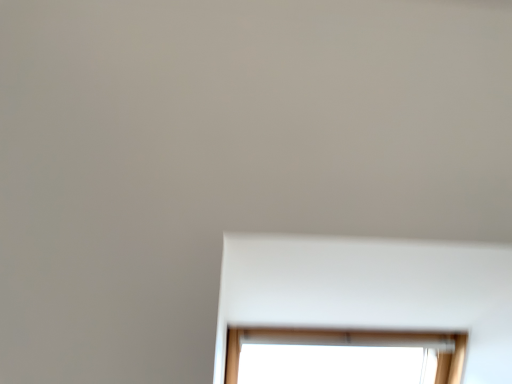
Question: Choose the correct answer: Is white matte bay window at lower center inside transparent glass window at center or outside it?

Choices:
 (A) outside
 (B) inside

Answer: (A)

Question: Considering the positions of white matte bay window at lower center and transparent glass window at center in the image, is white matte bay window at lower center bigger or smaller than transparent glass window at center?

Choices:
 (A) small
 (B) big

Answer: (A)

Question: Considering the positions of white matte bay window at lower center and transparent glass window at center in the image, is white matte bay window at lower center taller or shorter than transparent glass window at center?

Choices:
 (A) tall
 (B) short

Answer: (B)

Question: Considering their positions, is transparent glass window at center located in front of or behind white matte bay window at lower center?

Choices:
 (A) front
 (B) behind

Answer: (B)

Question: In terms of width, does transparent glass window at center look wider or thinner when compared to white matte bay window at lower center?

Choices:
 (A) wide
 (B) thin

Answer: (B)

Question: From their relative heights in the image, would you say transparent glass window at center is taller or shorter than white matte bay window at lower center?

Choices:
 (A) tall
 (B) short

Answer: (A)

Question: From the image's perspective, is transparent glass window at center positioned above or below white matte bay window at lower center?

Choices:
 (A) above
 (B) below

Answer: (B)